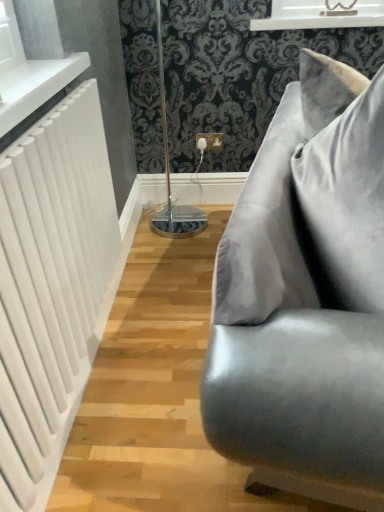
Question: Is satin gray pillow at right bigger or smaller than satin gray couch at right?

Choices:
 (A) small
 (B) big

Answer: (A)

Question: From a real-world perspective, is satin gray pillow at right positioned above or below satin gray couch at right?

Choices:
 (A) above
 (B) below

Answer: (A)

Question: Which of these objects is positioned farthest from the white glossy window frame at upper center?

Choices:
 (A) white matte radiator at left
 (B) white glossy radiator at upper left
 (C) satin gray couch at right
 (D) satin gray pillow at right

Answer: (D)

Question: Which of these objects is positioned closest to the white glossy radiator at upper left?

Choices:
 (A) white matte radiator at left
 (B) satin gray couch at right
 (C) satin gray pillow at right
 (D) white glossy window frame at upper center

Answer: (A)